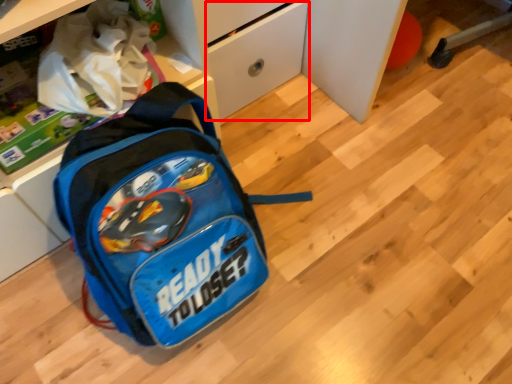
Question: In this image, where is drawer (annotated by the red box) located relative to backpack?

Choices:
 (A) left
 (B) right

Answer: (B)